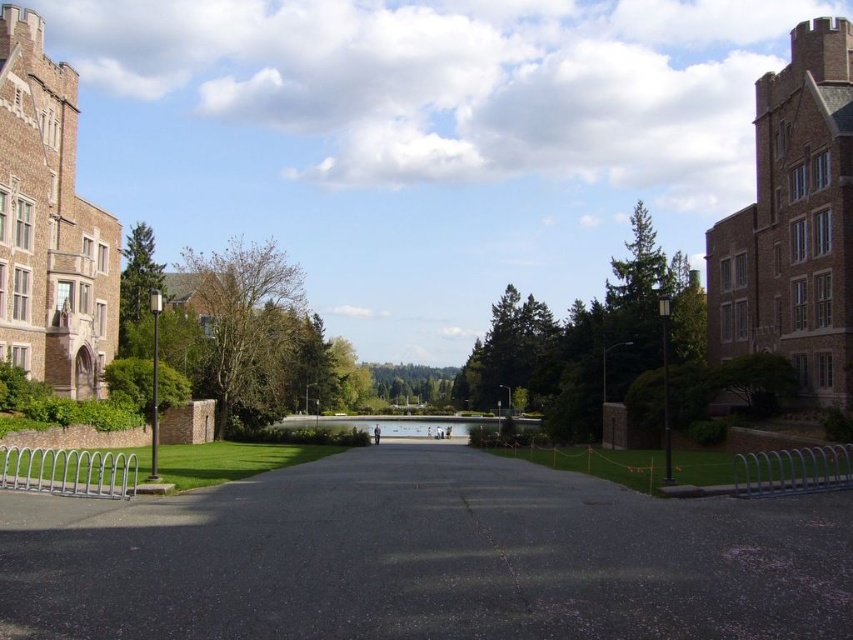
You are a student walking along the black asphalt path at center and the clear glass lake at center is visible ahead. Which object will you encounter first as you continue moving forward?

The black asphalt path at center is in front of the clear glass lake at center, so you will encounter the black asphalt path at center first before reaching the lake.

You are a student walking on the black asphalt path at center and want to reach the clear glass lake at center. Which direction should you move to get to the lake?

The black asphalt path at center is positioned on the right side of clear glass lake at center, so you should move to your left to reach the lake.